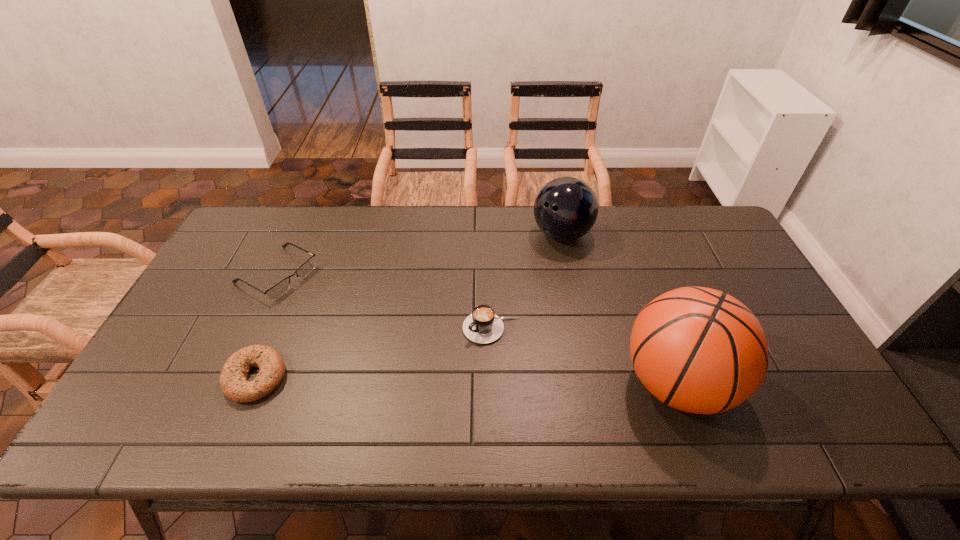
What are the coordinates of `vacant space on the desktop that is between the bagel and the tallest object and is positioned on the side of the second tallest object with the finger holes` in the screenshot? It's located at tap(435, 380).

Image resolution: width=960 pixels, height=540 pixels. What are the coordinates of `free space on the desktop that is between the bagel and the basketball and is positioned with the handle on the side of the third object from left to right` in the screenshot? It's located at (433, 380).

Identify the location of vacant space on the desktop that is between the bagel and the basketball and is positioned on the front-facing side of the spectacles. The image size is (960, 540). (479, 381).